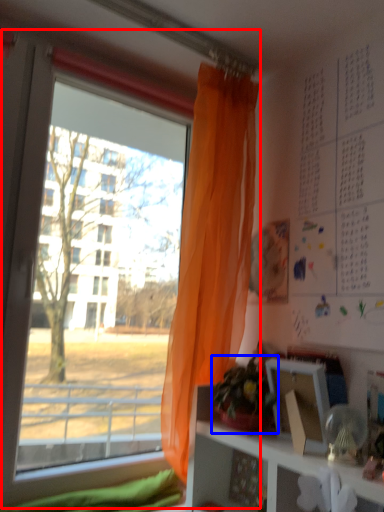
Question: Among these objects, which one is farthest to the camera, window (highlighted by a red box) or houseplant (highlighted by a blue box)?

Choices:
 (A) window
 (B) houseplant

Answer: (B)